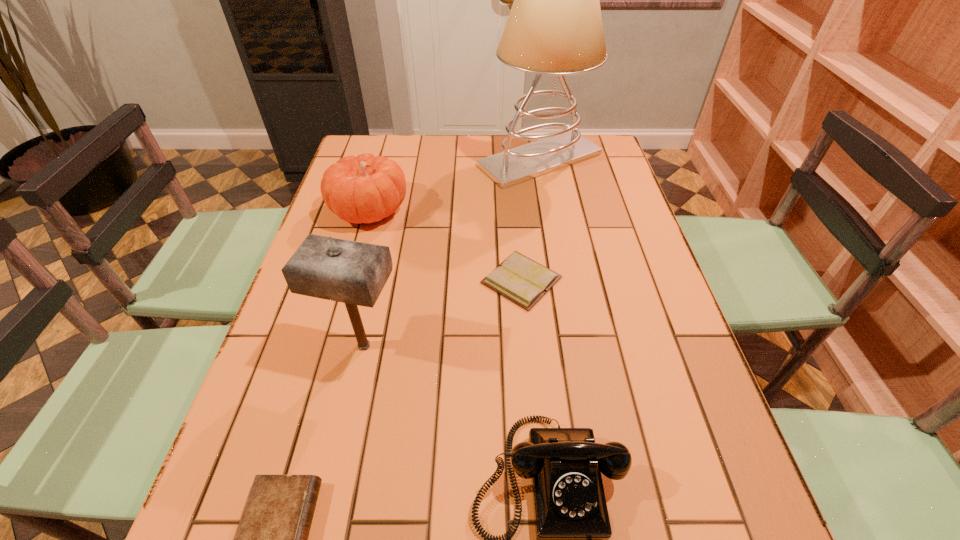
Where is `object located in the far edge section of the desktop`? object located in the far edge section of the desktop is located at coordinates (555, 27).

Identify the location of mallet that is at the left edge. The width and height of the screenshot is (960, 540). (354, 273).

Where is `pumpkin positioned at the left edge`? The height and width of the screenshot is (540, 960). pumpkin positioned at the left edge is located at coordinates (364, 189).

In order to click on object positioned at the right edge in this screenshot , I will do `click(555, 27)`.

The image size is (960, 540). I want to click on object present at the far right corner, so click(x=555, y=27).

The height and width of the screenshot is (540, 960). I want to click on vacant area at the far edge of the desktop, so click(524, 144).

Identify the location of vacant space at the left edge of the desktop. The image size is (960, 540). (x=303, y=356).

Where is `blank space at the right edge of the desktop`? blank space at the right edge of the desktop is located at coordinates (673, 335).

This screenshot has height=540, width=960. In order to click on free area in between the table lamp and the fourth nearest object in this screenshot , I will do `click(531, 220)`.

I want to click on vacant space in between the fourth farthest object and the farther diary, so click(443, 313).